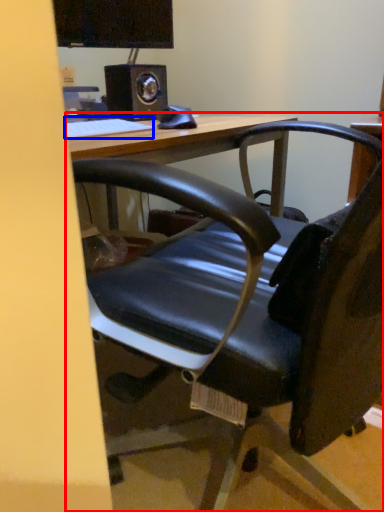
Question: Which of the following is the closest to the observer, table (highlighted by a red box) or keyboard (highlighted by a blue box)?

Choices:
 (A) table
 (B) keyboard

Answer: (A)